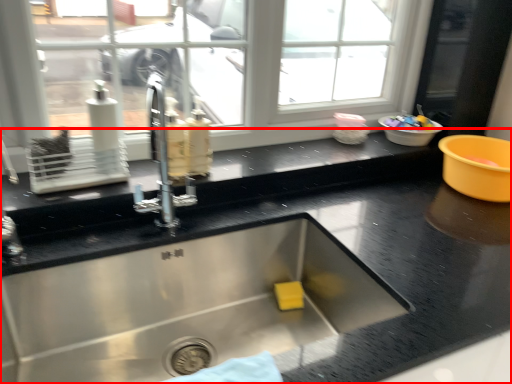
Question: In this image, where is countertop (annotated by the red box) located relative to basin?

Choices:
 (A) right
 (B) left

Answer: (B)